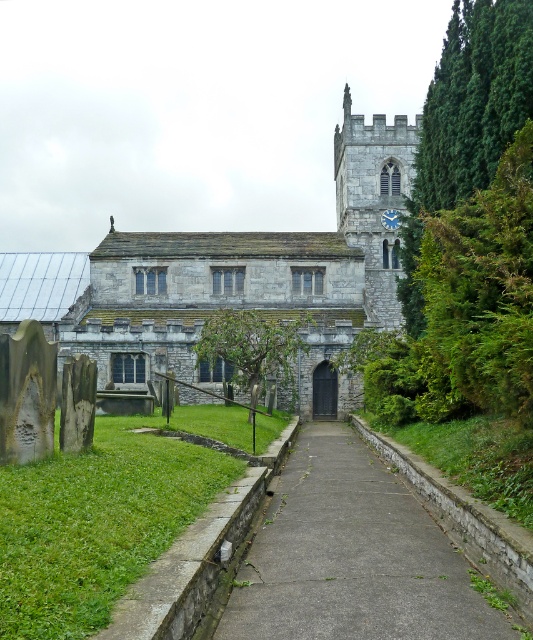
Question: Can you confirm if gray stone church at center is positioned below concrete at center?

Choices:
 (A) no
 (B) yes

Answer: (A)

Question: Which point appears closest to the camera in this image?

Choices:
 (A) (353, 202)
 (B) (310, 532)

Answer: (B)

Question: Is gray stone church at center positioned in front of concrete at center?

Choices:
 (A) no
 (B) yes

Answer: (A)

Question: Which point appears closest to the camera in this image?

Choices:
 (A) (410, 532)
 (B) (387, 228)

Answer: (A)

Question: From the image, what is the correct spatial relationship of gray stone church at center in relation to concrete at center?

Choices:
 (A) below
 (B) above

Answer: (B)